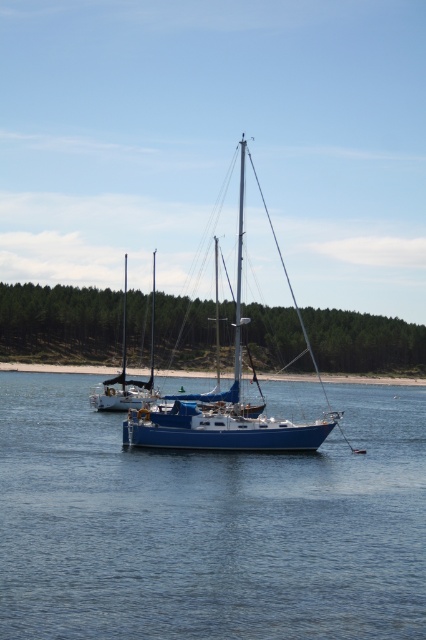
Is blue water at center above blue matte sailboat at center?

No, blue water at center is not above blue matte sailboat at center.

Is point (20, 570) farther from camera compared to point (314, 364)?

No, (20, 570) is closer to viewer.

Locate an element on the screen. This screenshot has height=640, width=426. blue water at center is located at coordinates (209, 524).